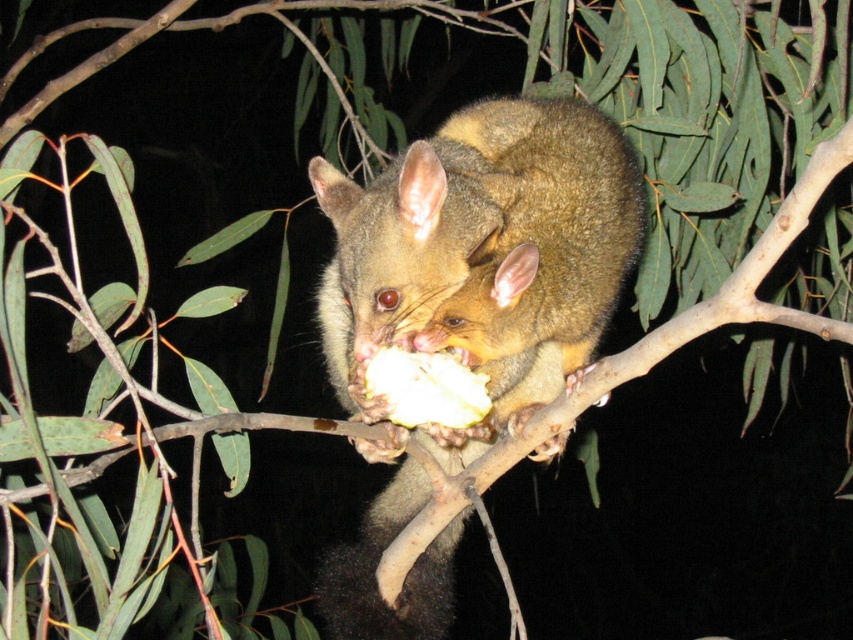
Question: Does furry brown possum at center have a larger size compared to white matte fruit at center?

Choices:
 (A) no
 (B) yes

Answer: (B)

Question: Among these points, which one is farthest from the camera?

Choices:
 (A) (379, 266)
 (B) (419, 401)

Answer: (B)

Question: Is furry brown possum at center smaller than white matte fruit at center?

Choices:
 (A) yes
 (B) no

Answer: (B)

Question: Is furry brown possum at center above white matte fruit at center?

Choices:
 (A) yes
 (B) no

Answer: (B)